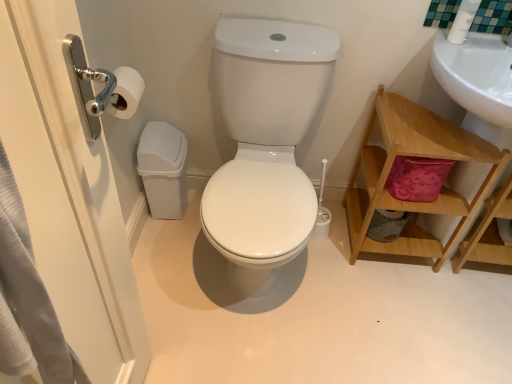
You are a GUI agent. You are given a task and a screenshot of the screen. Output one action in this format:
    pyautogui.click(x=<x>, y=<y>)
    Task: Click on the free space in front of white glossy toilet at center
    Image resolution: width=512 pixels, height=384 pixels.
    Given the screenshot: What is the action you would take?
    pyautogui.click(x=269, y=349)